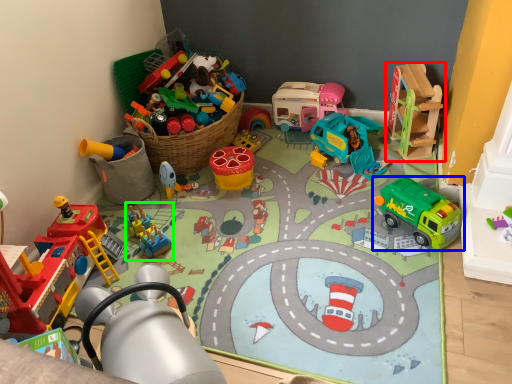
Question: Considering the real-world distances, which object is closest to toy (highlighted by a red box)? toy (highlighted by a blue box) or toy (highlighted by a green box).

Choices:
 (A) toy
 (B) toy

Answer: (A)